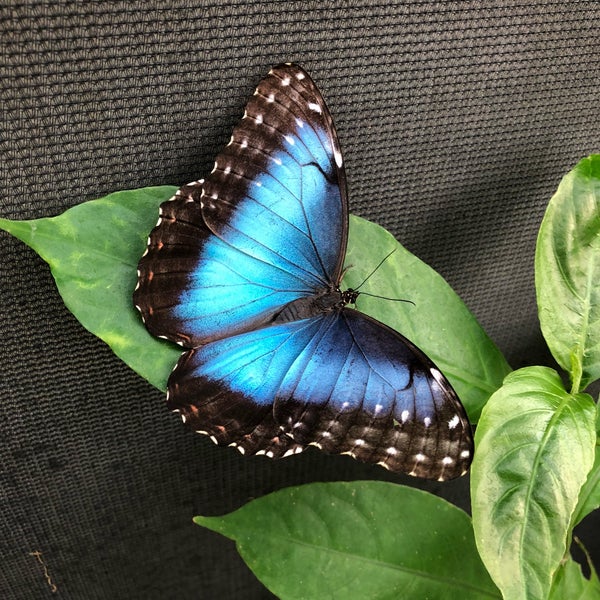
This screenshot has width=600, height=600. In order to click on wall in this screenshot , I will do `click(83, 428)`.